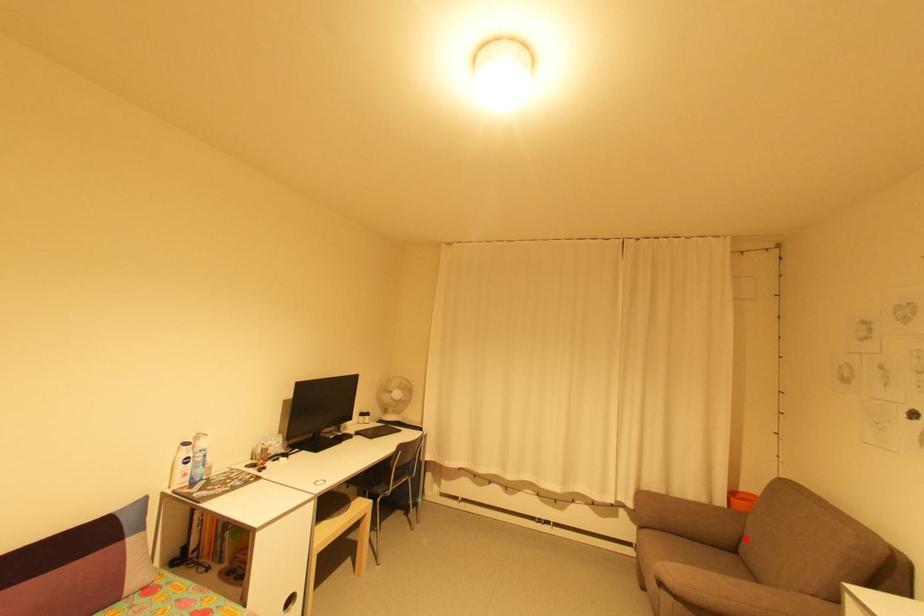
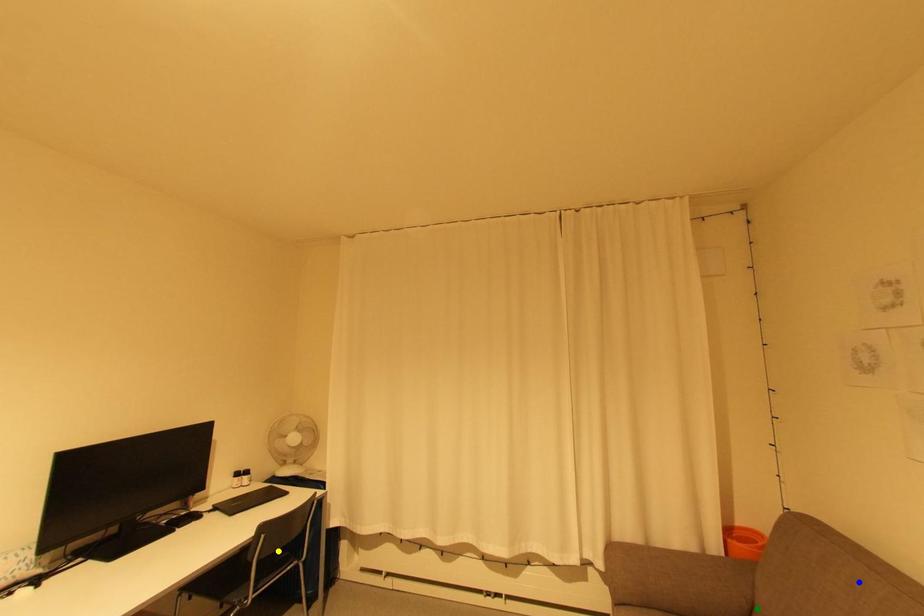
Question: I am providing you with two images of the same scene from different viewpoints. A red point is marked on the first image. You are given multiple points on the second image. Can you choose the point in image 2 that corresponds to the point in image 1?

Choices:
 (A) blue point
 (B) yellow point
 (C) green point

Answer: (C)